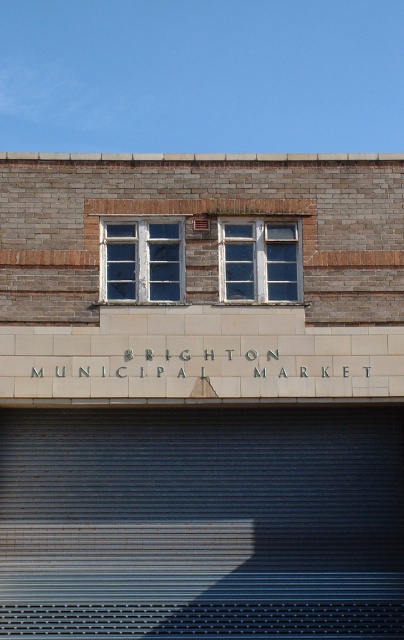
How much distance is there between metallic gray garage door at bottom and white tile sign at center?

metallic gray garage door at bottom and white tile sign at center are 1.71 meters apart.

Who is taller, metallic gray garage door at bottom or white tile sign at center?

metallic gray garage door at bottom

The width and height of the screenshot is (404, 640). What do you see at coordinates (202, 522) in the screenshot?
I see `metallic gray garage door at bottom` at bounding box center [202, 522].

This screenshot has height=640, width=404. Identify the location of metallic gray garage door at bottom. (202, 522).

Who is higher up, white wooden window at upper center or blue glass window at upper center?

white wooden window at upper center is above.

Is white wooden window at upper center taller than blue glass window at upper center?

Yes, white wooden window at upper center is taller than blue glass window at upper center.

The height and width of the screenshot is (640, 404). What are the coordinates of `white wooden window at upper center` in the screenshot? It's located at (141, 259).

Identify the location of white wooden window at upper center. This screenshot has height=640, width=404. (141, 259).

Is metallic gray garage door at bottom shorter than white wooden window at upper center?

No, metallic gray garage door at bottom is not shorter than white wooden window at upper center.

Is point (387, 548) positioned after point (164, 268)?

Yes, it is behind point (164, 268).

The image size is (404, 640). Identify the location of metallic gray garage door at bottom. (202, 522).

You are a GUI agent. You are given a task and a screenshot of the screen. Output one action in this format:
    pyautogui.click(x=<x>, y=<y>)
    Task: Click on the metallic gray garage door at bottom
    Image resolution: width=404 pixels, height=640 pixels.
    Given the screenshot: What is the action you would take?
    pyautogui.click(x=202, y=522)